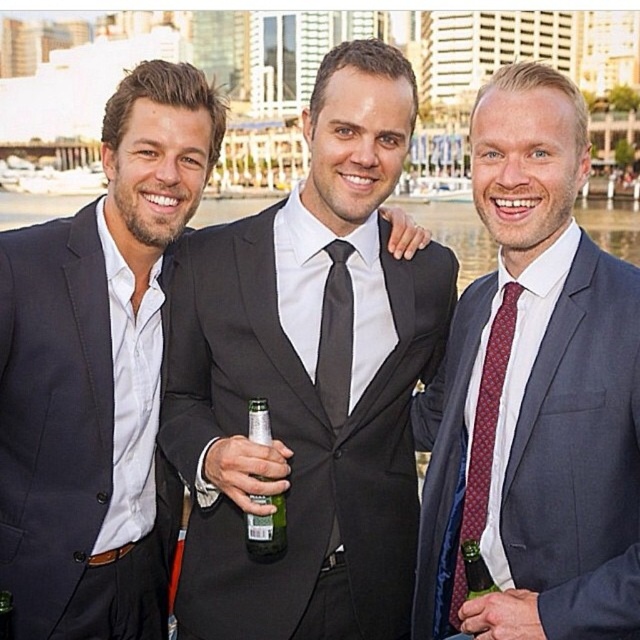
You are attending a formal event and notice two men in the scene. One is wearing a black satin suit at center and the other a dark blue wool suit at left. Based on their positions, which man is standing closer to the left side of the scene?

The dark blue wool suit at left is closer to the left side of the scene because the black satin suit at center is positioned to its right.

From the picture: You are standing at the origin point in the image and want to move towards the two points labeled as point (374, 525) and point (26, 568). Which point should you aim for first if you want to reach the one that is farther away from you?

You should aim for point (374, 525) first because it is farther away from you compared to point (26, 568).